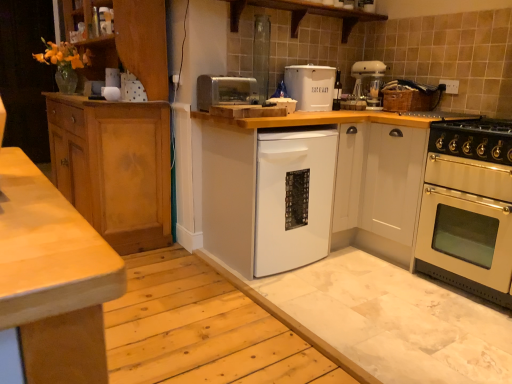
Question: Which direction should I rotate to face white matte dishwasher at center, arranged as the second cabinetry when viewed from the right, — up or down?

Choices:
 (A) up
 (B) down

Answer: (A)

Question: Should I look upward or downward to see white glossy cabinet at right, the third cabinetry viewed from the left?

Choices:
 (A) down
 (B) up

Answer: (B)

Question: Considering the relative sizes of gold metallic gas stove at right and silver metallic toaster at center in the image provided, is gold metallic gas stove at right thinner than silver metallic toaster at center?

Choices:
 (A) no
 (B) yes

Answer: (A)

Question: Is silver metallic toaster at center at the back of gold metallic gas stove at right?

Choices:
 (A) no
 (B) yes

Answer: (A)

Question: Would you say gold metallic gas stove at right is a long distance from silver metallic toaster at center?

Choices:
 (A) no
 (B) yes

Answer: (B)

Question: Considering the relative positions of gold metallic gas stove at right and silver metallic toaster at center in the image provided, is gold metallic gas stove at right to the left of silver metallic toaster at center from the viewer's perspective?

Choices:
 (A) yes
 (B) no

Answer: (B)

Question: From the image's perspective, is gold metallic gas stove at right beneath silver metallic toaster at center?

Choices:
 (A) yes
 (B) no

Answer: (A)

Question: Is gold metallic gas stove at right shorter than silver metallic toaster at center?

Choices:
 (A) no
 (B) yes

Answer: (A)

Question: Can you confirm if wooden at upper center is positioned to the left of white matte dishwasher at center, arranged as the second cabinetry when viewed from the right?

Choices:
 (A) no
 (B) yes

Answer: (B)

Question: From a real-world perspective, does wooden at upper center sit lower than white matte dishwasher at center, arranged as the second cabinetry when viewed from the right?

Choices:
 (A) no
 (B) yes

Answer: (A)

Question: Is wooden at upper center next to white matte dishwasher at center, arranged as the second cabinetry when viewed from the right?

Choices:
 (A) yes
 (B) no

Answer: (B)

Question: Is wooden at upper center bigger than white matte dishwasher at center, which appears as the 2th cabinetry when viewed from the left?

Choices:
 (A) yes
 (B) no

Answer: (B)

Question: Can you confirm if wooden at upper center is smaller than white matte dishwasher at center, arranged as the second cabinetry when viewed from the right?

Choices:
 (A) no
 (B) yes

Answer: (B)

Question: Is the position of wooden at upper center less distant than that of white matte dishwasher at center, arranged as the second cabinetry when viewed from the right?

Choices:
 (A) yes
 (B) no

Answer: (B)

Question: Is stainless steel oven at right not within light brown wood cabinet at left, marked as the first cabinetry in a left-to-right arrangement?

Choices:
 (A) no
 (B) yes

Answer: (B)